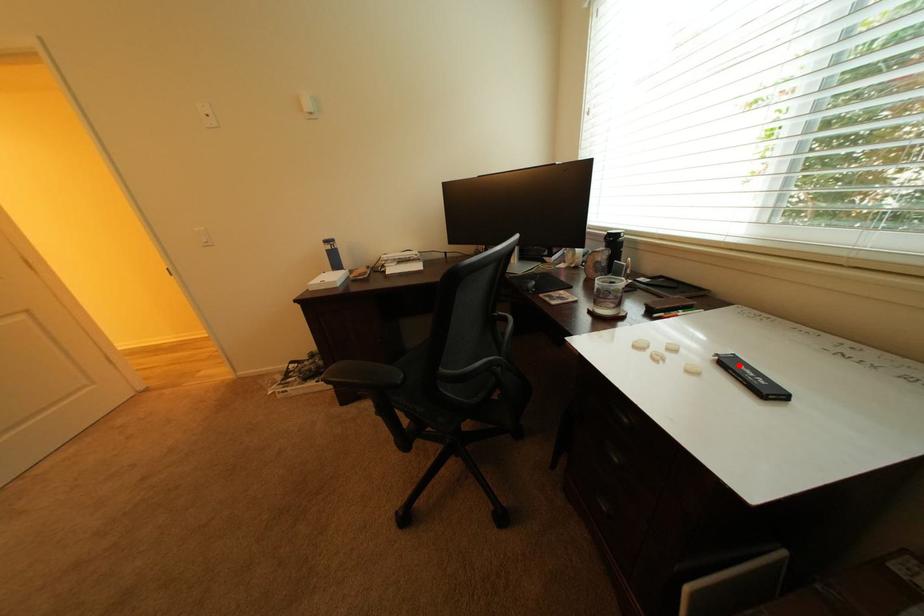
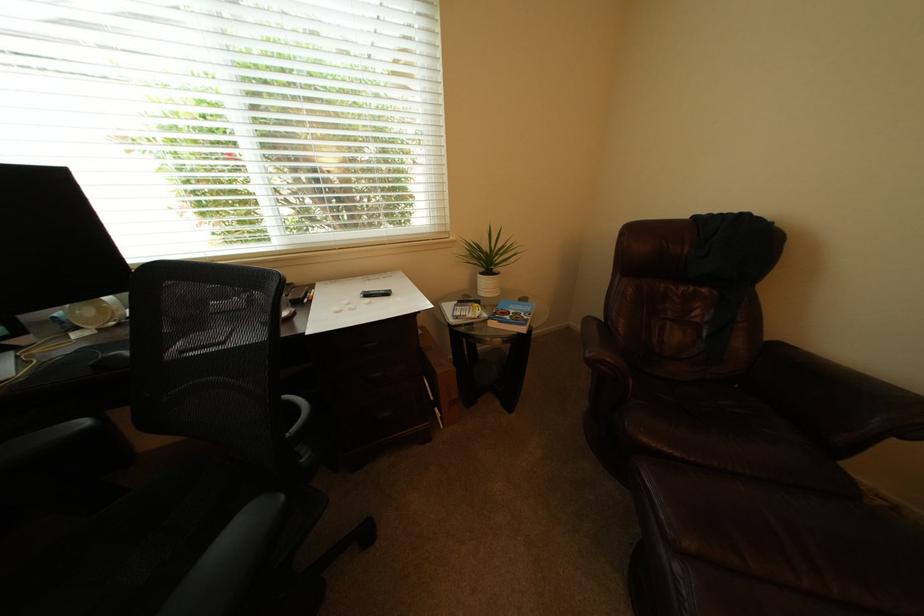
The point at the highlighted location is marked in the first image. Where is the corresponding point in the second image?

(378, 297)